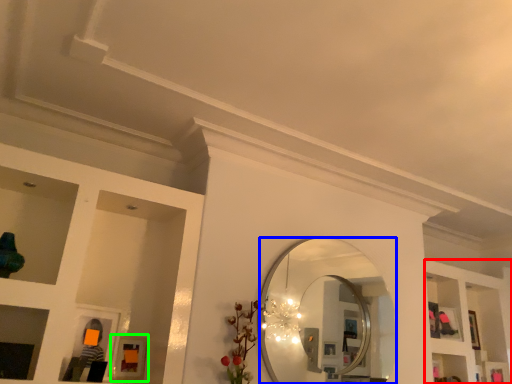
Question: Which object is the closest to the shelf (highlighted by a red box)? Choose among these: mirror (highlighted by a blue box) or picture frame (highlighted by a green box).

Choices:
 (A) mirror
 (B) picture frame

Answer: (A)